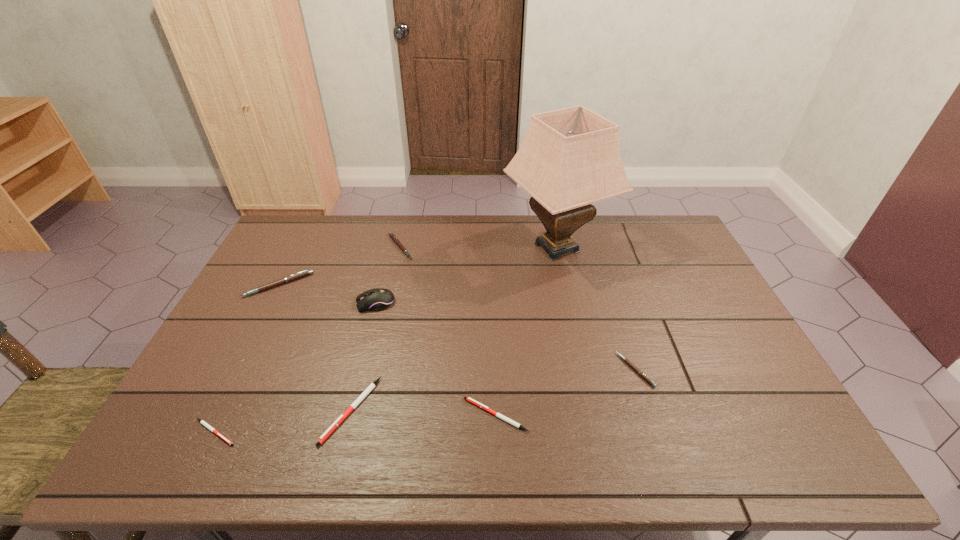
You are a GUI agent. You are given a task and a screenshot of the screen. Output one action in this format:
    pyautogui.click(x=<x>, y=<y>)
    Task: Click on the smallest pink pen
    
    Given the screenshot: What is the action you would take?
    pyautogui.click(x=644, y=376)

The width and height of the screenshot is (960, 540). In order to click on the rightmost white pen in this screenshot , I will do `click(504, 418)`.

In order to click on the second biggest white pen in this screenshot , I will do `click(504, 418)`.

Find the location of `the shortest pen`. the shortest pen is located at coordinates (202, 422).

Find the location of a particular element. the leftmost white pen is located at coordinates (202, 422).

This screenshot has width=960, height=540. What are the coordinates of `vacant position located on the left of the tallest object` in the screenshot? It's located at (479, 247).

Identify the location of vacant space located 0.270m on the back of the computer mouse. The image size is (960, 540). (391, 243).

Image resolution: width=960 pixels, height=540 pixels. In order to click on vacant region located 0.200m at the nib of the fifth nearest pen in this screenshot , I will do `click(247, 349)`.

This screenshot has width=960, height=540. I want to click on vacant region located at the nib of the farthest pink pen, so (x=495, y=247).

You are a GUI agent. You are given a task and a screenshot of the screen. Output one action in this format:
    pyautogui.click(x=<x>, y=<y>)
    Task: Click on the free space located 0.210m at the nib of the rightmost pink pen
    Image resolution: width=960 pixels, height=540 pixels.
    Given the screenshot: What is the action you would take?
    pyautogui.click(x=541, y=370)